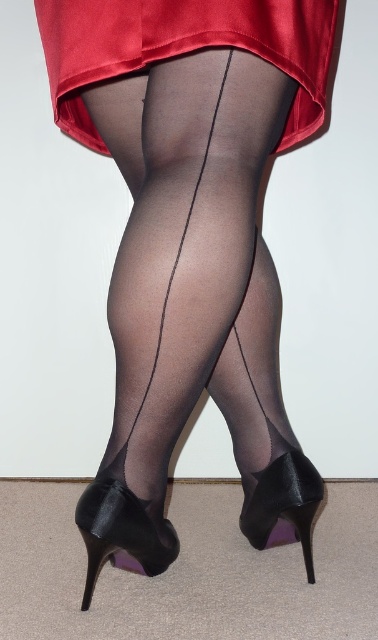
From the picture: Between satin dress at upper center and shiny black high-heeled shoe at lower center, which one is positioned lower?

shiny black high-heeled shoe at lower center is below.

Image resolution: width=378 pixels, height=640 pixels. What do you see at coordinates (182, 49) in the screenshot?
I see `satin dress at upper center` at bounding box center [182, 49].

Is point (322, 52) less distant than point (317, 490)?

Yes, it is in front of point (317, 490).

Identify the location of satin dress at upper center. Image resolution: width=378 pixels, height=640 pixels. (182, 49).

In the scene shown: Who is more distant from viewer, (103, 60) or (122, 548)?

The point (122, 548) is more distant.

This screenshot has width=378, height=640. Identify the location of satin dress at upper center. (182, 49).

Is point (130, 524) positioned before point (285, 490)?

That is True.

Describe the element at coordinates (122, 532) in the screenshot. The height and width of the screenshot is (640, 378). I see `black satin shoe at lower center` at that location.

Locate an element on the screen. This screenshot has width=378, height=640. black satin shoe at lower center is located at coordinates (122, 532).